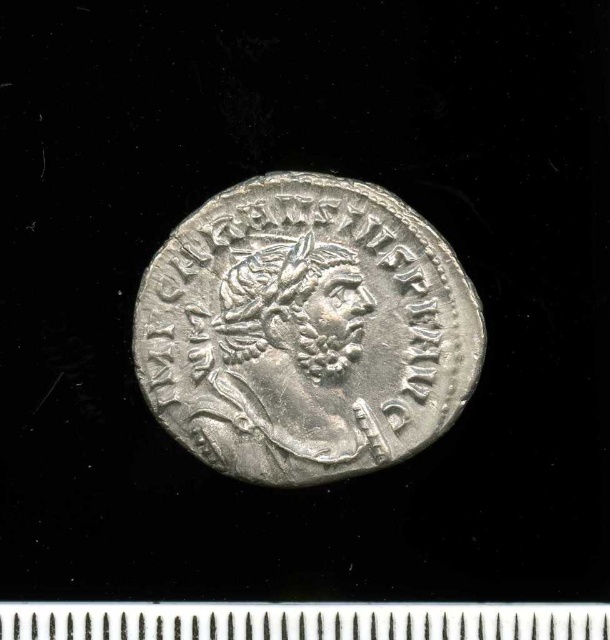
You are an archaeologist examining the silver metallic coin at center and the metallic ruler at bottom. You need to determine which object is taller. Which one is taller?

The silver metallic coin at center is taller than the metallic ruler at bottom.

You are an archaeologist examining the image. You need to determine the position of the silver metallic coin at center relative to the metallic ruler at bottom. Which object is located to the right side?

The silver metallic coin at center is to the right of the metallic ruler at bottom.

You are an archaeologist examining the silver metallic coin at center and the metallic ruler at bottom. Which object is closer to your eyes?

The silver metallic coin at center is closer to your eyes than the metallic ruler at bottom because it is further to the viewer.